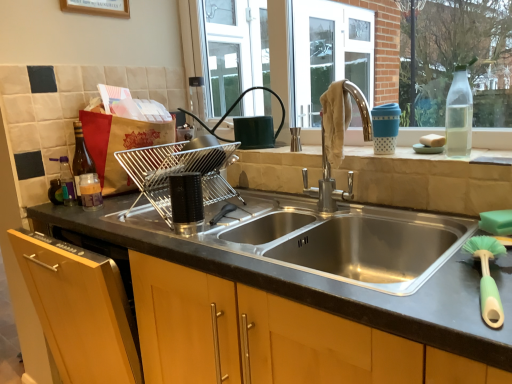
In order to click on free location to the right of translucent plastic bottle at left, which is the second bottle in right-to-left order in this screenshot , I will do `click(132, 211)`.